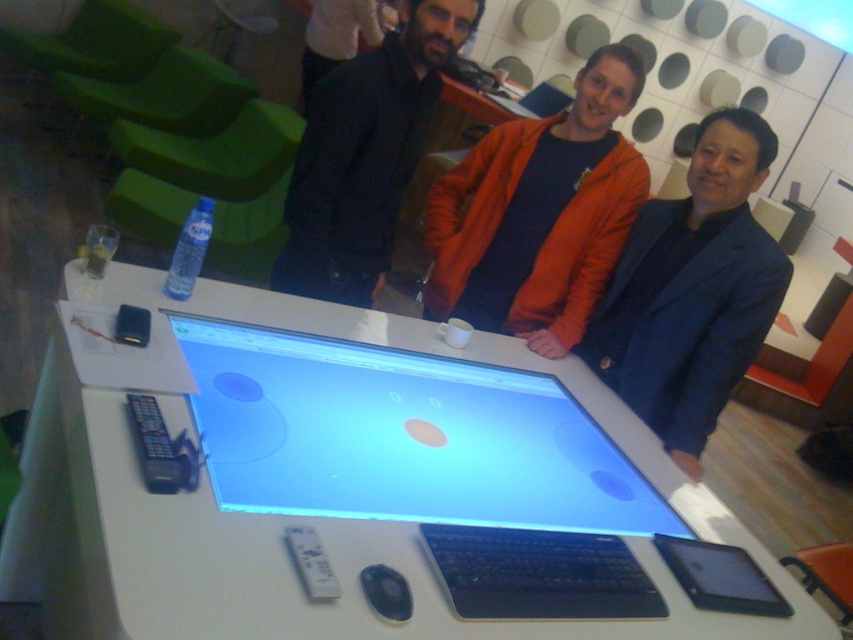
You are a delivery person who needs to place a package on the table between the dark blue textured blazer at center and the black plastic mouse at center. Can you fit the package there if it measures 15 cm in width?

The dark blue textured blazer at center is further to the viewer than the black plastic mouse at center, so the space between them is at least 15 cm. Therefore, the package can fit there.

Based on the photo, you are organizing a photoshoot and need to place two jackets on a mannequin stand. The dark blue textured blazer at center and the black matte jacket at upper center must be arranged so that the wider jacket is placed on the lower part of the stand for stability. Which jacket should you place at the bottom?

The black matte jacket at upper center should be placed at the bottom because it has a greater width than the dark blue textured blazer at center, making it more stable.